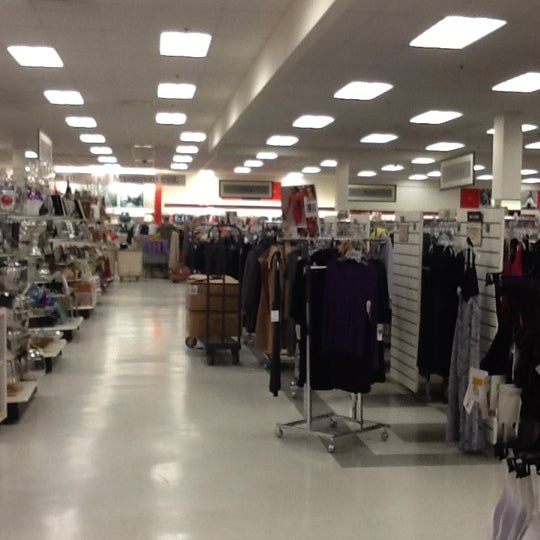
This screenshot has height=540, width=540. I want to click on tile floor, so click(x=161, y=468).